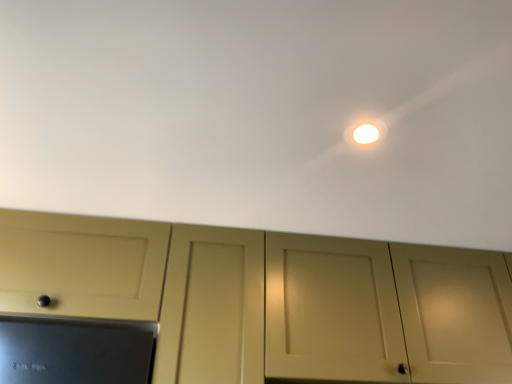
What do you see at coordinates (365, 131) in the screenshot? The height and width of the screenshot is (384, 512). I see `white glossy light at upper center` at bounding box center [365, 131].

In order to face matte cream cabinet at center, should I rotate leftwards or rightwards?

You should look right and rotate roughly 21.148 degrees.

Describe the element at coordinates (263, 115) in the screenshot. This screenshot has height=384, width=512. I see `white matte ceiling at upper center` at that location.

Find the location of a particular element. The image size is (512, 384). white glossy light at upper center is located at coordinates (365, 131).

From the image's perspective, is white matte ceiling at upper center above white glossy light at upper center?

No, from the image's perspective, white matte ceiling at upper center is not over white glossy light at upper center.

Is white glossy light at upper center at the back of white matte ceiling at upper center?

No, white matte ceiling at upper center is not facing away from white glossy light at upper center.

Identify the location of light above the white matte ceiling at upper center (from the image's perspective). The image size is (512, 384). (365, 131).

Would you say matte cream cabinet at center is outside white matte ceiling at upper center?

matte cream cabinet at center lies outside white matte ceiling at upper center's area.

Does point (367, 283) come in front of point (204, 102)?

No, it is behind (204, 102).

Based on the photo, who is shorter, matte cream cabinet at center or white matte ceiling at upper center?

Standing shorter between the two is white matte ceiling at upper center.

Is matte cream cabinet at center closer to camera compared to white matte ceiling at upper center?

No, matte cream cabinet at center is further to the viewer.

Based on their positions, is matte cream cabinet at center located to the left or right of white glossy light at upper center?

Based on their positions, matte cream cabinet at center is located to the right of white glossy light at upper center.

Which of these two, matte cream cabinet at center or white glossy light at upper center, stands shorter?

Standing shorter between the two is white glossy light at upper center.

Which of these two, matte cream cabinet at center or white glossy light at upper center, is wider?

matte cream cabinet at center.

Based on the photo, which of these two, white glossy light at upper center or matte cream cabinet at center, stands shorter?

Standing shorter between the two is white glossy light at upper center.

Between white glossy light at upper center and matte cream cabinet at center, which one has smaller width?

white glossy light at upper center.

Between point (346, 141) and point (294, 238), which one is positioned in front?

The point (346, 141) is more forward.

Is white glossy light at upper center inside the boundaries of matte cream cabinet at center, or outside?

white glossy light at upper center lies outside matte cream cabinet at center.

From a real-world perspective, is white glossy light at upper center physically below white matte ceiling at upper center?

Yes.

Between white glossy light at upper center and white matte ceiling at upper center, which one appears on the right side from the viewer's perspective?

white glossy light at upper center.

Is white glossy light at upper center facing towards white matte ceiling at upper center?

Yes, white glossy light at upper center faces towards white matte ceiling at upper center.

How much distance is there between white glossy light at upper center and white matte ceiling at upper center?

They are 14.03 inches apart.

Is white matte ceiling at upper center located outside matte cream cabinet at center?

white matte ceiling at upper center is positioned outside matte cream cabinet at center.

Based on the photo, from a real-world perspective, does white matte ceiling at upper center sit lower than matte cream cabinet at center?

No, from a real-world perspective, white matte ceiling at upper center is not below matte cream cabinet at center.

Which point is more distant from viewer, (312, 19) or (280, 377)?

Positioned behind is point (280, 377).

Looking at their sizes, would you say white matte ceiling at upper center is wider or thinner than matte cream cabinet at center?

Clearly, white matte ceiling at upper center has more width compared to matte cream cabinet at center.

Where is `light behind the white matte ceiling at upper center`? The width and height of the screenshot is (512, 384). light behind the white matte ceiling at upper center is located at coordinates (365, 131).

Image resolution: width=512 pixels, height=384 pixels. What are the coordinates of `backdrop above the matte cream cabinet at center (from a real-world perspective)` in the screenshot? It's located at (263, 115).

When comparing their distances from matte cream cabinet at center, does white glossy light at upper center or white matte ceiling at upper center seem further?

Among the two, white glossy light at upper center is located further to matte cream cabinet at center.

Looking at the image, which one is located closer to matte cream cabinet at center, white matte ceiling at upper center or white glossy light at upper center?

white matte ceiling at upper center lies closer to matte cream cabinet at center than the other object.

When comparing their distances from white matte ceiling at upper center, does white glossy light at upper center or matte cream cabinet at center seem further?

Among the two, matte cream cabinet at center is located further to white matte ceiling at upper center.

Which object lies further to the anchor point white glossy light at upper center, white matte ceiling at upper center or matte cream cabinet at center?

matte cream cabinet at center is positioned further to the anchor white glossy light at upper center.

Considering their positions, is matte cream cabinet at center positioned closer to white matte ceiling at upper center than white glossy light at upper center?

The object closer to white matte ceiling at upper center is white glossy light at upper center.

Which object lies nearer to the anchor point white glossy light at upper center, matte cream cabinet at center or white matte ceiling at upper center?

white matte ceiling at upper center.

I want to click on backdrop between white glossy light at upper center and matte cream cabinet at center vertically, so click(x=263, y=115).